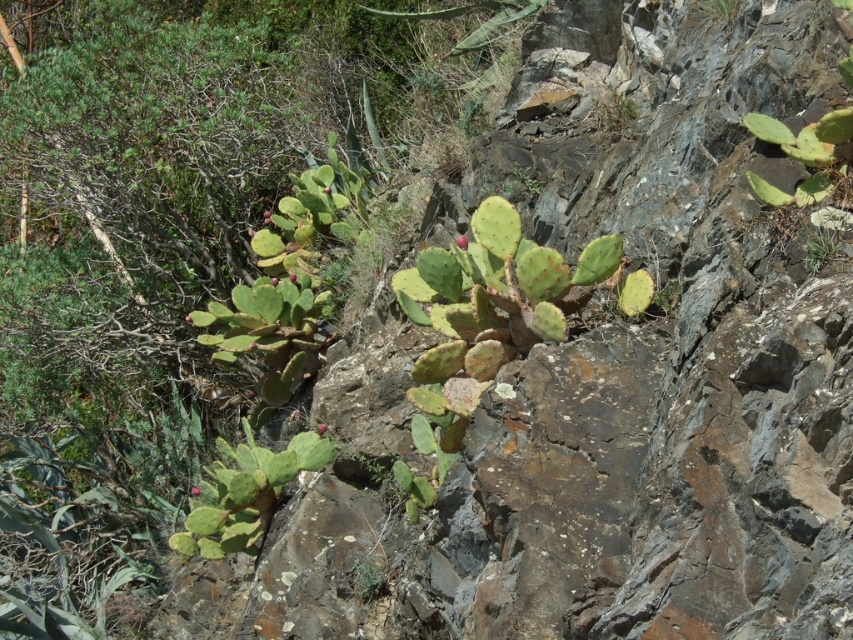
Question: Which of the following is the closest to the observer?

Choices:
 (A) green spiny cactus at upper right
 (B) green spiny cactus at lower left

Answer: (A)

Question: Does green spiny cactus at lower left have a smaller size compared to green spiny cactus at upper right?

Choices:
 (A) yes
 (B) no

Answer: (B)

Question: Does green spiny cactus at lower left appear on the right side of green spiny cactus at upper right?

Choices:
 (A) no
 (B) yes

Answer: (A)

Question: Which object is farther from the camera taking this photo?

Choices:
 (A) green spiny cactus at upper right
 (B) green spiny cactus at lower left

Answer: (B)

Question: Among these points, which one is farthest from the camera?

Choices:
 (A) (262, 445)
 (B) (816, 266)

Answer: (A)

Question: Does green spiny cactus at lower left have a greater width compared to green spiny cactus at upper right?

Choices:
 (A) no
 (B) yes

Answer: (B)